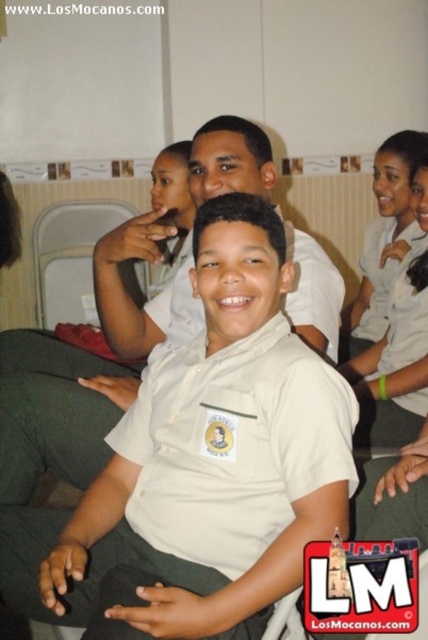
Question: Can you confirm if white uniform shirt at center is wider than white matte uniform at center?

Choices:
 (A) no
 (B) yes

Answer: (B)

Question: Which point is farther to the camera?

Choices:
 (A) (180, 337)
 (B) (270, 221)

Answer: (A)

Question: Among these objects, which one is farthest from the camera?

Choices:
 (A) white matte uniform at center
 (B) white uniform shirt at center

Answer: (A)

Question: Which of the following is the farthest from the observer?

Choices:
 (A) (305, 237)
 (B) (178, 417)

Answer: (A)

Question: Is white uniform shirt at center to the right of white matte uniform at center from the viewer's perspective?

Choices:
 (A) yes
 (B) no

Answer: (A)

Question: Does white uniform shirt at center have a lesser width compared to white matte uniform at center?

Choices:
 (A) yes
 (B) no

Answer: (B)